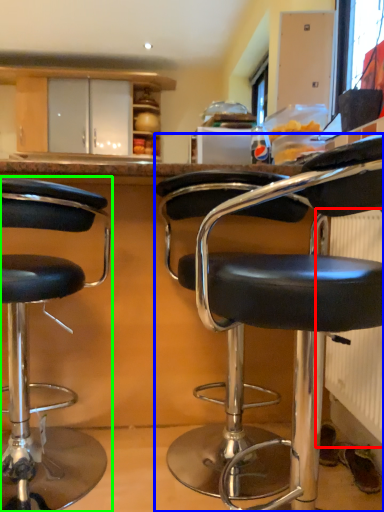
Question: Which object is the farthest from radiator (highlighted by a red box)? Choose among these: chair (highlighted by a blue box) or chair (highlighted by a green box).

Choices:
 (A) chair
 (B) chair

Answer: (B)